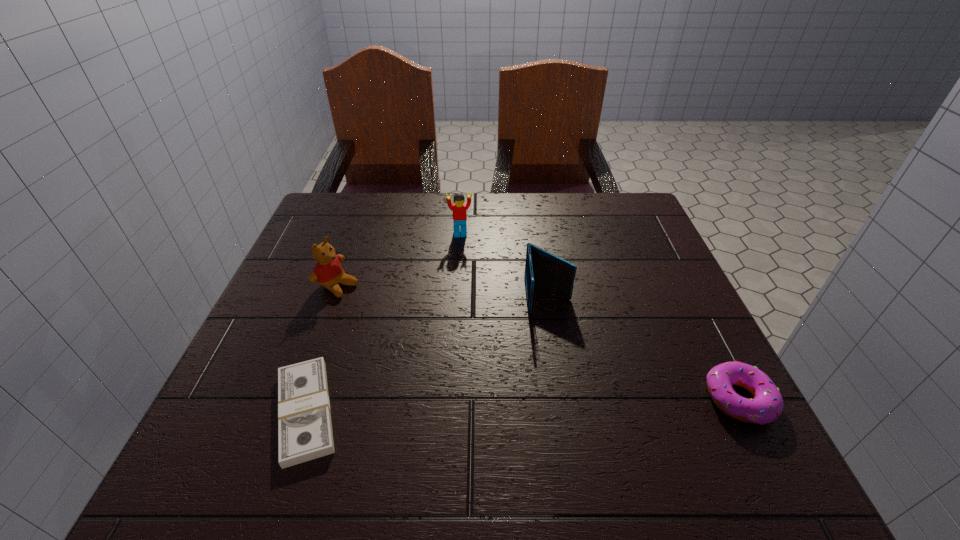
Image resolution: width=960 pixels, height=540 pixels. In order to click on vacant space at the far right corner of the desktop in this screenshot , I will do `click(636, 234)`.

The width and height of the screenshot is (960, 540). I want to click on free space between the doughnut and the wallet, so click(643, 347).

Locate an element on the screen. The image size is (960, 540). unoccupied area between the Lego and the second shortest object is located at coordinates (600, 316).

This screenshot has height=540, width=960. What are the coordinates of `vacant space in between the doughnut and the second object from right to left` in the screenshot? It's located at (643, 347).

Locate an element on the screen. The height and width of the screenshot is (540, 960). empty space between the dollar and the teddy bear is located at coordinates (323, 348).

What are the coordinates of `vacant point located between the doughnut and the farthest object` in the screenshot? It's located at (600, 316).

Locate an element on the screen. unoccupied position between the Lego and the second object from right to left is located at coordinates (504, 265).

Locate an element on the screen. unoccupied area between the shortest object and the second shortest object is located at coordinates (522, 405).

The width and height of the screenshot is (960, 540). I want to click on empty space that is in between the doughnut and the shortest object, so click(x=522, y=405).

I want to click on vacant point located between the rightmost object and the fourth object from left to right, so click(643, 347).